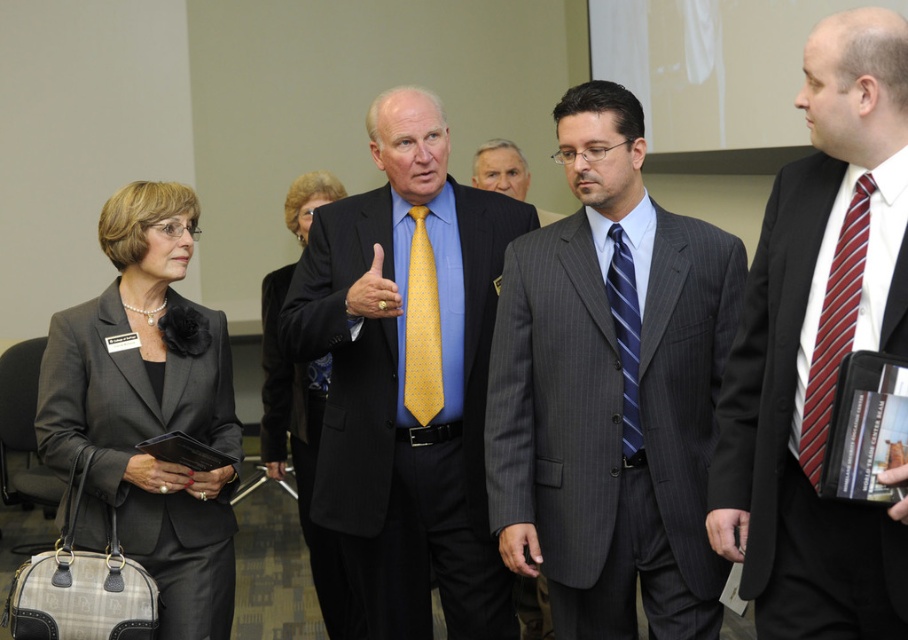
Question: Which point is closer to the camera?

Choices:
 (A) gray pinstripe suit at center
 (B) yellow silk tie at center
 (C) maroon striped tie at right
 (D) black pinstripe suit at right

Answer: (D)

Question: Is gray pinstripe suit at center smaller than black pinstripe suit at right?

Choices:
 (A) yes
 (B) no

Answer: (B)

Question: Which object is farther from the camera taking this photo?

Choices:
 (A) maroon striped tie at right
 (B) blue striped tie at center
 (C) yellow silk tie at center

Answer: (C)

Question: Is matte gray blazer at left positioned behind matte black blazer at center?

Choices:
 (A) no
 (B) yes

Answer: (A)

Question: Estimate the real-world distances between objects in this image. Which object is closer to the matte black blazer at center?

Choices:
 (A) maroon striped tie at right
 (B) gray pinstripe suit at center

Answer: (B)

Question: Is black pinstripe suit at right thinner than yellow dotted tie at center?

Choices:
 (A) yes
 (B) no

Answer: (B)